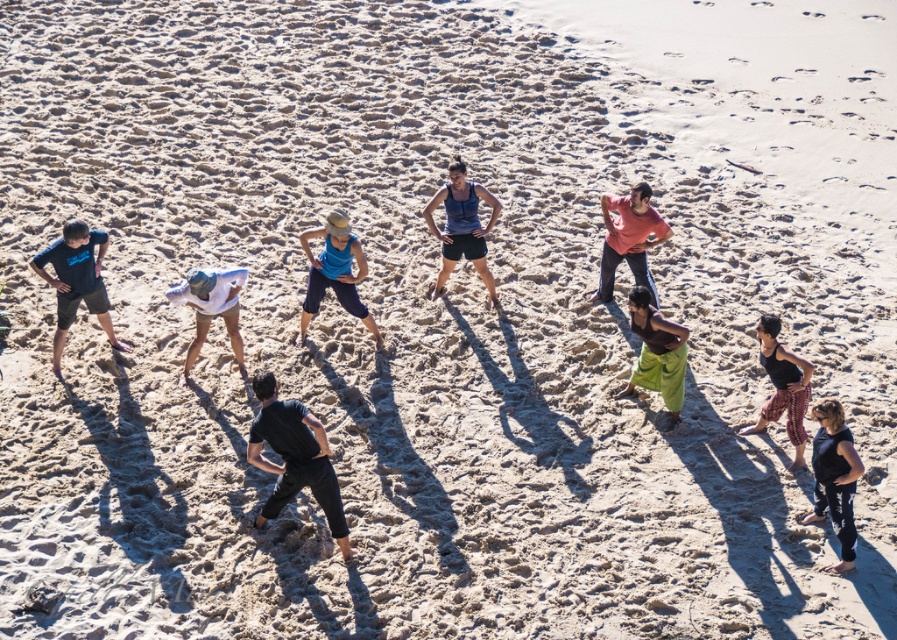
Question: Which is nearer to the black matte shirt at center?

Choices:
 (A) blue fabric shorts at center
 (B) green cotton pants at center
 (C) white cotton shirt at center

Answer: (C)

Question: In this image, where is matte black shorts at left located relative to blue fabric shorts at center?

Choices:
 (A) left
 (B) right

Answer: (A)

Question: Which is farther from the matte black shorts at left?

Choices:
 (A) black matte shirt at center
 (B) matte red shirt at upper right

Answer: (B)

Question: Which object is the closest to the matte blue tank top at center?

Choices:
 (A) black fabric pants at lower right
 (B) black matte tank top at lower right
 (C) matte black shorts at left
 (D) white cotton shirt at center

Answer: (D)

Question: Can you confirm if black matte shirt at center is thinner than green cotton pants at center?

Choices:
 (A) yes
 (B) no

Answer: (B)

Question: Observing the image, what is the correct spatial positioning of blue fabric shorts at center in reference to black fabric pants at lower right?

Choices:
 (A) above
 (B) below

Answer: (A)